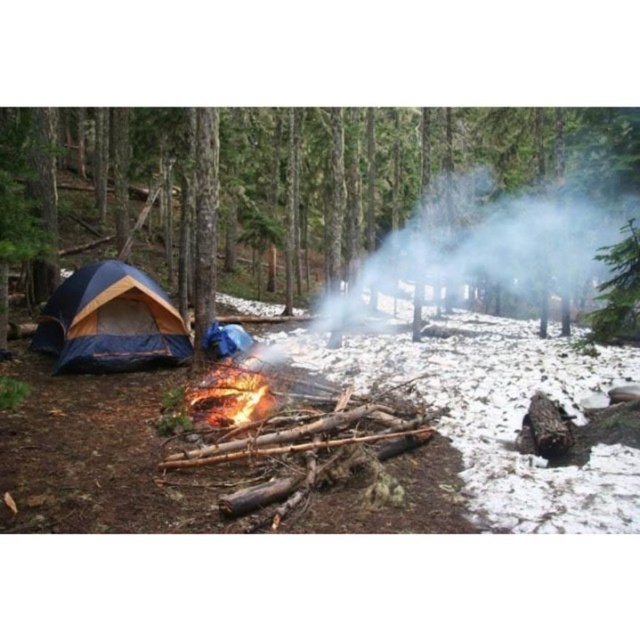
You are planning to set up a small table between the blue tarpaulin tent at left and the flaming wood at center. Based on their sizes, which object should you place the table closer to to ensure it fits comfortably?

The blue tarpaulin tent at left might be wider than the flaming wood at center, so placing the table closer to the blue tarpaulin tent at left would provide more space for the table to fit comfortably.

You are a camper who wants to set up a tarp to protect your gear from the rain. You have a tarp that is the same size as the blue fabric tent at left. Will the tarp be large enough to cover the flaming wood at center?

The blue fabric tent at left is bigger than flaming wood at center, so the tarp, which is the same size as the tent, will be large enough to cover the flaming wood at center.

You are planning to set up a tent in the camping area shown. You have two tents available, the blue fabric tent at left and the blue tarpaulin tent at left. Which tent would you choose if you want the one that can accommodate more people?

The blue fabric tent at left has a larger size compared to the blue tarpaulin tent at left, so it can accommodate more people.